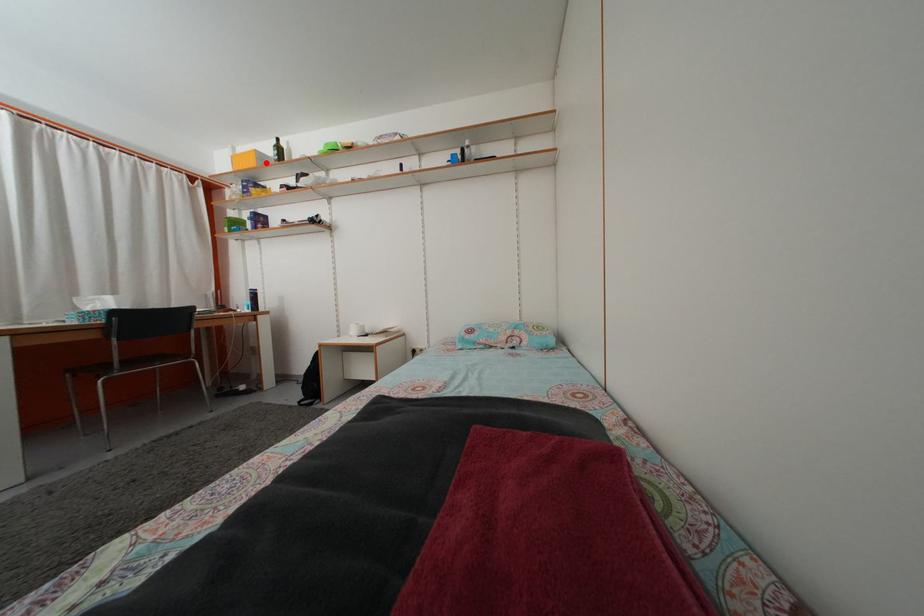
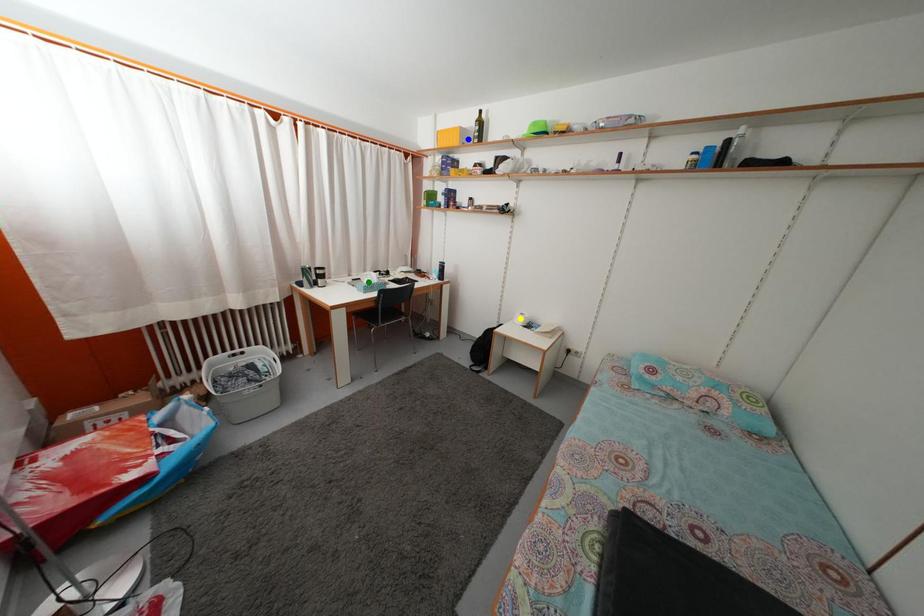
Question: I am providing you with two images of the same scene from different viewpoints. A red point is marked on the first image. You are given multiple points on the second image. Which mark in image 2 goes with the point in image 1?

Choices:
 (A) green point
 (B) yellow point
 (C) blue point

Answer: (C)